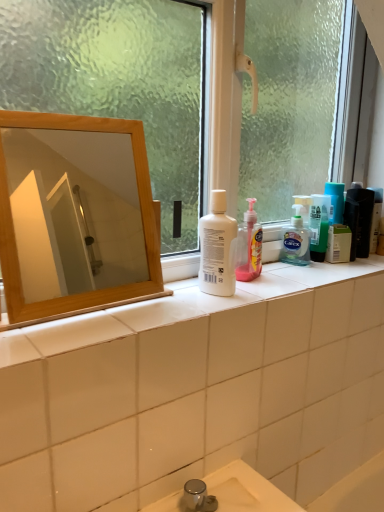
Locate an element on the screen. The width and height of the screenshot is (384, 512). matte black hair care product at right, acting as the 1th toiletry starting from the left is located at coordinates (359, 220).

What do you see at coordinates (375, 217) in the screenshot?
I see `translucent plastic bottle at right, the first toiletry positioned from the right` at bounding box center [375, 217].

I want to click on white plastic bottle at center, so click(218, 248).

Can you confirm if matte black hair care product at right, the second toiletry when ordered from right to left, is smaller than white plastic bottle at center?

Indeed, matte black hair care product at right, the second toiletry when ordered from right to left, has a smaller size compared to white plastic bottle at center.

From the image's perspective, is matte black hair care product at right, acting as the 1th toiletry starting from the left, under white plastic bottle at center?

Incorrect, from the image's perspective, matte black hair care product at right, acting as the 1th toiletry starting from the left, is higher than white plastic bottle at center.

Between matte black hair care product at right, acting as the 1th toiletry starting from the left, and white plastic bottle at center, which one has larger width?

With larger width is white plastic bottle at center.

From a real-world perspective, is matte black hair care product at right, acting as the 1th toiletry starting from the left, on white plastic bottle at center?

No, from a real-world perspective, matte black hair care product at right, acting as the 1th toiletry starting from the left, is not over white plastic bottle at center

From a real-world perspective, is translucent plastic bottle at right, the 2th toiletry positioned from the left, located beneath transparent glass window at center?

Yes.

Measure the distance from translucent plastic bottle at right, the first toiletry positioned from the right, to transparent glass window at center.

They are 23.26 inches apart.

Is translucent plastic bottle at right, the 2th toiletry positioned from the left, oriented away from transparent glass window at center?

Yes, translucent plastic bottle at right, the 2th toiletry positioned from the left, is facing away from transparent glass window at center.

Would you say transparent glass window at center is part of translucent plastic bottle at right, the 2th toiletry positioned from the left,'s contents?

That's incorrect, transparent glass window at center is not inside translucent plastic bottle at right, the 2th toiletry positioned from the left.

How many degrees apart are the facing directions of white plastic bottle at center and wooden mirror at upper left?

1.18 degrees.

Which object is thinner, white plastic bottle at center or wooden mirror at upper left?

wooden mirror at upper left.

From the picture: Is white plastic bottle at center closer to camera compared to wooden mirror at upper left?

No, white plastic bottle at center is further to the viewer.

Which of these two, wooden mirror at upper left or white plastic bottle at center, stands shorter?

Standing shorter between the two is white plastic bottle at center.

Who is more distant, wooden mirror at upper left or white plastic bottle at center?

white plastic bottle at center is behind.

Consider the image. Would you say white plastic bottle at center is part of wooden mirror at upper left's contents?

No, white plastic bottle at center is not surrounded by wooden mirror at upper left.

From a real-world perspective, who is located higher, wooden mirror at upper left or white plastic bottle at center?

wooden mirror at upper left is physically above.

Between translucent plastic bottle at right, the first toiletry positioned from the right, and white plastic bottle at center, which one has larger size?

white plastic bottle at center is bigger.

Does translucent plastic bottle at right, the 2th toiletry positioned from the left, have a lesser width compared to white plastic bottle at center?

Yes, translucent plastic bottle at right, the 2th toiletry positioned from the left, is thinner than white plastic bottle at center.

Is translucent plastic bottle at right, the 2th toiletry positioned from the left, facing away from white plastic bottle at center?

That's not correct — translucent plastic bottle at right, the 2th toiletry positioned from the left, is not looking away from white plastic bottle at center.

Would you say white plastic bottle at center is part of translucent plastic bottle at right, the first toiletry positioned from the right,'s contents?

No, translucent plastic bottle at right, the first toiletry positioned from the right, does not contain white plastic bottle at center.

Considering the sizes of objects wooden mirror at upper left and transparent glass window at center in the image provided, who is wider, wooden mirror at upper left or transparent glass window at center?

transparent glass window at center.

Is wooden mirror at upper left with transparent glass window at center?

wooden mirror at upper left and transparent glass window at center are not in contact.

Looking at the image, does wooden mirror at upper left seem bigger or smaller compared to transparent glass window at center?

In the image, wooden mirror at upper left appears to be smaller than transparent glass window at center.

Looking at this image, how many degrees apart are the facing directions of white plastic bottle at center and matte black hair care product at right, acting as the 1th toiletry starting from the left?

The angle between the facing direction of white plastic bottle at center and the facing direction of matte black hair care product at right, acting as the 1th toiletry starting from the left, is 0.00573 degrees.

Considering the relative sizes of white plastic bottle at center and matte black hair care product at right, acting as the 1th toiletry starting from the left, in the image provided, is white plastic bottle at center thinner than matte black hair care product at right, acting as the 1th toiletry starting from the left,?

In fact, white plastic bottle at center might be wider than matte black hair care product at right, acting as the 1th toiletry starting from the left.

Does white plastic bottle at center turn towards matte black hair care product at right, acting as the 1th toiletry starting from the left?

No.

The width and height of the screenshot is (384, 512). I want to click on cleaning product in front of the matte black hair care product at right, acting as the 1th toiletry starting from the left, so click(x=218, y=248).

Identify the location of window above the translucent plastic bottle at right, the 2th toiletry positioned from the left (from the image's perspective). The width and height of the screenshot is (384, 512). (225, 97).

Based on the photo, when comparing their distances from matte black hair care product at right, acting as the 1th toiletry starting from the left, does white plastic bottle at center or wooden mirror at upper left seem closer?

Based on the image, white plastic bottle at center appears to be nearer to matte black hair care product at right, acting as the 1th toiletry starting from the left.

Looking at the image, which one is located closer to transparent glass window at center, white plastic bottle at center or translucent plastic bottle at right, the first toiletry positioned from the right?

white plastic bottle at center lies closer to transparent glass window at center than the other object.

From the image, which object appears to be farther from matte black hair care product at right, the second toiletry when ordered from right to left, translucent plastic bottle at right, the 2th toiletry positioned from the left, or transparent glass window at center?

transparent glass window at center is positioned further to the anchor matte black hair care product at right, the second toiletry when ordered from right to left.

Looking at the image, which one is located further to white plastic bottle at center, wooden mirror at upper left or matte black hair care product at right, the second toiletry when ordered from right to left?

The object further to white plastic bottle at center is wooden mirror at upper left.

Considering their positions, is matte black hair care product at right, acting as the 1th toiletry starting from the left, positioned closer to transparent glass window at center than white plastic bottle at center?

The object closer to transparent glass window at center is white plastic bottle at center.

Considering their positions, is transparent glass window at center positioned further to matte black hair care product at right, the second toiletry when ordered from right to left, than translucent plastic bottle at right, the first toiletry positioned from the right?

transparent glass window at center is further to matte black hair care product at right, the second toiletry when ordered from right to left.

From the image, which object appears to be nearer to transparent glass window at center, wooden mirror at upper left or white plastic bottle at center?

white plastic bottle at center is positioned closer to the anchor transparent glass window at center.

Considering their positions, is white plastic bottle at center positioned further to translucent plastic bottle at right, the first toiletry positioned from the right, than wooden mirror at upper left?

wooden mirror at upper left is positioned further to the anchor translucent plastic bottle at right, the first toiletry positioned from the right.

Image resolution: width=384 pixels, height=512 pixels. In order to click on window between wooden mirror at upper left and matte black hair care product at right, the second toiletry when ordered from right to left, from left to right in this screenshot , I will do `click(225, 97)`.

In order to click on window located between wooden mirror at upper left and translucent plastic bottle at right, the first toiletry positioned from the right, in the left-right direction in this screenshot , I will do `click(225, 97)`.

The width and height of the screenshot is (384, 512). In order to click on cleaning product between wooden mirror at upper left and translucent plastic bottle at right, the first toiletry positioned from the right, from left to right in this screenshot , I will do `click(218, 248)`.

This screenshot has height=512, width=384. Identify the location of cleaning product between transparent glass window at center and translucent plastic bottle at right, the first toiletry positioned from the right, in the front-back direction. (218, 248).